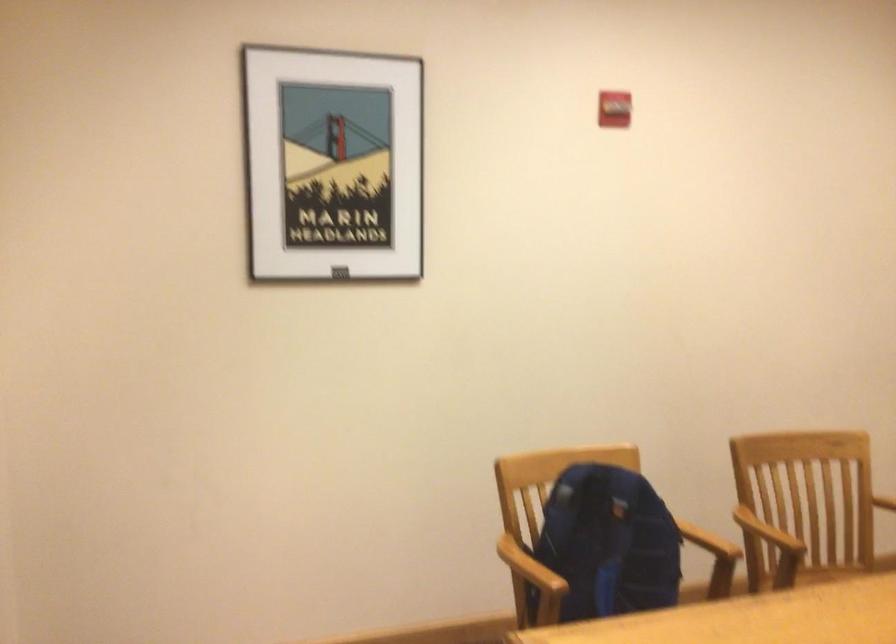
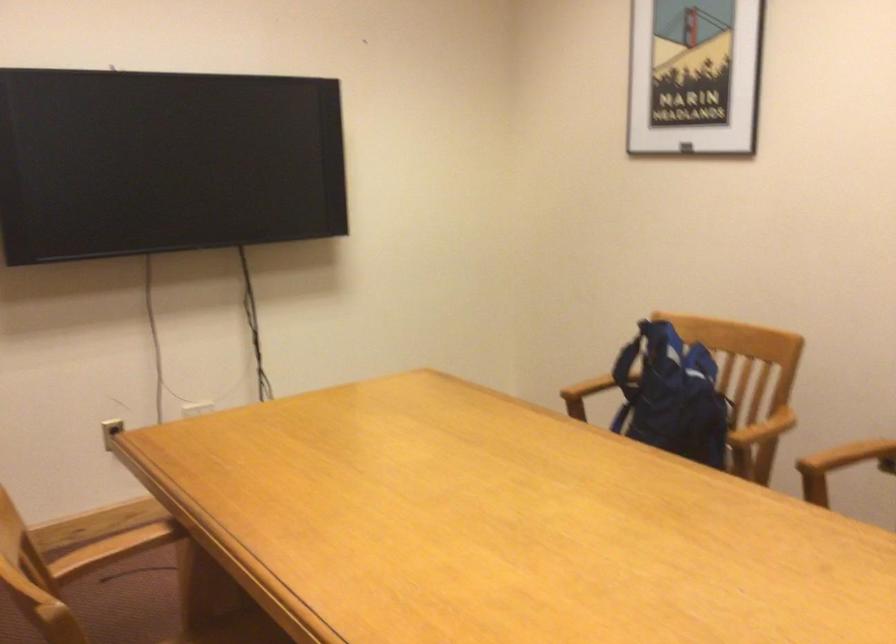
In the second image, find the point that corresponds to the point at 760,526 in the first image.

(849, 456)